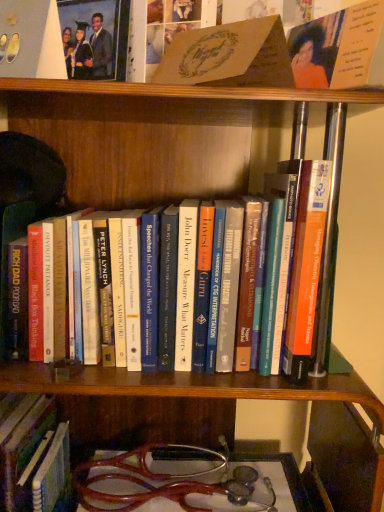
Measure the distance between matte brown card at upper center, which ranks as the second book in top-to-bottom order, and camera.

matte brown card at upper center, which ranks as the second book in top-to-bottom order, is 18.46 inches away from camera.

You are a GUI agent. You are given a task and a screenshot of the screen. Output one action in this format:
    pyautogui.click(x=<x>, y=<y>)
    Task: Click on the hardcover book at center, which appears as the 2th book when ordered from the bottom
    
    Given the screenshot: What is the action you would take?
    pyautogui.click(x=282, y=270)

The image size is (384, 512). What do you see at coordinates (88, 50) in the screenshot? I see `matte black graduation gown at upper left` at bounding box center [88, 50].

What are the coordinates of `matte brown card at upper center, which ranks as the second book in top-to-bottom order` in the screenshot? It's located at (229, 56).

From the image's perspective, is hardcover book at center, which is the 4th book from top to bottom, located above matte black graduation gown at upper left?

Incorrect, from the image's perspective, hardcover book at center, which is the 4th book from top to bottom, is lower than matte black graduation gown at upper left.

Measure the distance from hardcover book at center, which is the 4th book from top to bottom, to matte black graduation gown at upper left.

hardcover book at center, which is the 4th book from top to bottom, is 22.82 inches away from matte black graduation gown at upper left.

Where is `couple in front of the hardcover book at center, which is the 4th book from top to bottom`? The image size is (384, 512). couple in front of the hardcover book at center, which is the 4th book from top to bottom is located at coordinates (88, 50).

Considering the sizes of objects orange matte card at upper right, the 4th book ordered from the bottom, and hardcover book at center, placed as the 3th book when sorted from top to bottom, in the image provided, who is shorter, orange matte card at upper right, the 4th book ordered from the bottom, or hardcover book at center, placed as the 3th book when sorted from top to bottom,?

orange matte card at upper right, the 4th book ordered from the bottom, is shorter.

Is orange matte card at upper right, acting as the first book starting from the top, closer to the viewer compared to hardcover book at center, placed as the 3th book when sorted from top to bottom?

Yes, orange matte card at upper right, acting as the first book starting from the top, is closer to the viewer.

From a real-world perspective, is orange matte card at upper right, acting as the first book starting from the top, physically located above or below hardcover book at center, placed as the 3th book when sorted from top to bottom?

In terms of real-world spatial position, orange matte card at upper right, acting as the first book starting from the top, is above hardcover book at center, placed as the 3th book when sorted from top to bottom.

Based on their sizes in the image, would you say orange matte card at upper right, the 4th book ordered from the bottom, is bigger or smaller than hardcover book at center, which appears as the 2th book when ordered from the bottom?

Considering their sizes, orange matte card at upper right, the 4th book ordered from the bottom, takes up less space than hardcover book at center, which appears as the 2th book when ordered from the bottom.

From their relative heights in the image, would you say matte black graduation gown at upper left is taller or shorter than matte brown card at upper center, which ranks as the second book in top-to-bottom order?

Clearly, matte black graduation gown at upper left is taller compared to matte brown card at upper center, which ranks as the second book in top-to-bottom order.

Based on the photo, who is bigger, matte black graduation gown at upper left or matte brown card at upper center, which ranks as the second book in top-to-bottom order?

matte brown card at upper center, which ranks as the second book in top-to-bottom order.

From the picture: Would you say matte black graduation gown at upper left is to the left or to the right of matte brown card at upper center, the 3th book from the bottom, in the picture?

From the image, it's evident that matte black graduation gown at upper left is to the left of matte brown card at upper center, the 3th book from the bottom.

Would you say matte black graduation gown at upper left contains hardcover book at center, placed as the 3th book when sorted from top to bottom?

No, hardcover book at center, placed as the 3th book when sorted from top to bottom, is located outside of matte black graduation gown at upper left.

Which of these two, matte black graduation gown at upper left or hardcover book at center, which appears as the 2th book when ordered from the bottom, stands shorter?

With less height is matte black graduation gown at upper left.

Is matte black graduation gown at upper left oriented towards hardcover book at center, which appears as the 2th book when ordered from the bottom?

No, matte black graduation gown at upper left is not facing towards hardcover book at center, which appears as the 2th book when ordered from the bottom.

The image size is (384, 512). In order to click on couple above the hardcover book at center, which appears as the 2th book when ordered from the bottom (from the image's perspective) in this screenshot , I will do `click(88, 50)`.

Which is closer to the camera, (142, 263) or (50, 467)?

Point (142, 263) is closer to the camera than point (50, 467).

Which object is wider, hardcover book at center, which appears as the 2th book when ordered from the bottom, or hardcover book at center, which is the 4th book from top to bottom?

With larger width is hardcover book at center, which is the 4th book from top to bottom.

From their relative heights in the image, would you say hardcover book at center, which appears as the 2th book when ordered from the bottom, is taller or shorter than hardcover book at center, which is the 1th book from bottom to top?

Considering their sizes, hardcover book at center, which appears as the 2th book when ordered from the bottom, has less height than hardcover book at center, which is the 1th book from bottom to top.

Considering the relative sizes of hardcover book at center, placed as the 3th book when sorted from top to bottom, and hardcover book at center, which is the 1th book from bottom to top, in the image provided, is hardcover book at center, placed as the 3th book when sorted from top to bottom, smaller than hardcover book at center, which is the 1th book from bottom to top,?

Actually, hardcover book at center, placed as the 3th book when sorted from top to bottom, might be larger than hardcover book at center, which is the 1th book from bottom to top.

From a real-world perspective, between matte brown card at upper center, the 3th book from the bottom, and hardcover book at center, which is the 4th book from top to bottom, who is vertically higher?

matte brown card at upper center, the 3th book from the bottom, is physically above.

Which is in front, matte brown card at upper center, which ranks as the second book in top-to-bottom order, or hardcover book at center, which is the 1th book from bottom to top?

matte brown card at upper center, which ranks as the second book in top-to-bottom order.

Would you say matte brown card at upper center, the 3th book from the bottom, is to the left or to the right of hardcover book at center, which is the 4th book from top to bottom, in the picture?

matte brown card at upper center, the 3th book from the bottom, is to the right of hardcover book at center, which is the 4th book from top to bottom.

Starting from the hardcover book at center, which is the 1th book from bottom to top, which book is the 3rd one in front? Please provide its 2D coordinates.

[(229, 56)]

Is orange matte card at upper right, the 4th book ordered from the bottom, bigger than hardcover book at center, which is the 4th book from top to bottom?

No, orange matte card at upper right, the 4th book ordered from the bottom, is not bigger than hardcover book at center, which is the 4th book from top to bottom.

Can you confirm if orange matte card at upper right, acting as the first book starting from the top, is taller than hardcover book at center, which is the 1th book from bottom to top?

No.

Is orange matte card at upper right, the 4th book ordered from the bottom, facing away from hardcover book at center, which is the 1th book from bottom to top?

That's not correct — orange matte card at upper right, the 4th book ordered from the bottom, is not looking away from hardcover book at center, which is the 1th book from bottom to top.

Looking at this image, would you consider orange matte card at upper right, acting as the first book starting from the top, to be distant from hardcover book at center, which is the 4th book from top to bottom?

Actually, orange matte card at upper right, acting as the first book starting from the top, and hardcover book at center, which is the 4th book from top to bottom, are a little close together.

This screenshot has height=512, width=384. In order to click on couple above the hardcover book at center, which is the 1th book from bottom to top (from a real-world perspective) in this screenshot , I will do `click(88, 50)`.

Find the location of `the 2nd book above when counting from the hardcover book at center, placed as the 3th book when sorted from top to bottom (from the image's perspective)`. the 2nd book above when counting from the hardcover book at center, placed as the 3th book when sorted from top to bottom (from the image's perspective) is located at coordinates (340, 49).

Based on their spatial positions, is hardcover book at center, which is the 4th book from top to bottom, or matte brown card at upper center, which ranks as the second book in top-to-bottom order, further from hardcover book at center, placed as the 3th book when sorted from top to bottom?

hardcover book at center, which is the 4th book from top to bottom, lies further to hardcover book at center, placed as the 3th book when sorted from top to bottom, than the other object.

Looking at this image, estimate the real-world distances between objects in this image. Which object is further from orange matte card at upper right, the 4th book ordered from the bottom, matte black graduation gown at upper left or hardcover book at center, which is the 4th book from top to bottom?

The object further to orange matte card at upper right, the 4th book ordered from the bottom, is hardcover book at center, which is the 4th book from top to bottom.

From the image, which object appears to be nearer to matte black graduation gown at upper left, matte brown card at upper center, the 3th book from the bottom, or hardcover book at center, which appears as the 2th book when ordered from the bottom?

Among the two, matte brown card at upper center, the 3th book from the bottom, is located nearer to matte black graduation gown at upper left.

Considering their positions, is hardcover book at center, placed as the 3th book when sorted from top to bottom, positioned closer to matte black graduation gown at upper left than orange matte card at upper right, acting as the first book starting from the top?

orange matte card at upper right, acting as the first book starting from the top, is positioned closer to the anchor matte black graduation gown at upper left.

Which object lies nearer to the anchor point orange matte card at upper right, acting as the first book starting from the top, matte brown card at upper center, which ranks as the second book in top-to-bottom order, or matte black graduation gown at upper left?

Among the two, matte brown card at upper center, which ranks as the second book in top-to-bottom order, is located nearer to orange matte card at upper right, acting as the first book starting from the top.

When comparing their distances from orange matte card at upper right, the 4th book ordered from the bottom, does hardcover book at center, placed as the 3th book when sorted from top to bottom, or matte brown card at upper center, which ranks as the second book in top-to-bottom order, seem further?

hardcover book at center, placed as the 3th book when sorted from top to bottom.

Based on their spatial positions, is hardcover book at center, which is the 4th book from top to bottom, or matte brown card at upper center, which ranks as the second book in top-to-bottom order, closer to matte black graduation gown at upper left?

matte brown card at upper center, which ranks as the second book in top-to-bottom order, is closer to matte black graduation gown at upper left.

From the image, which object appears to be farther from hardcover book at center, which is the 4th book from top to bottom, matte brown card at upper center, which ranks as the second book in top-to-bottom order, or hardcover book at center, which appears as the 2th book when ordered from the bottom?

matte brown card at upper center, which ranks as the second book in top-to-bottom order, is further to hardcover book at center, which is the 4th book from top to bottom.

The image size is (384, 512). What are the coordinates of `book between orange matte card at upper right, acting as the first book starting from the top, and hardcover book at center, placed as the 3th book when sorted from top to bottom, in the vertical direction` in the screenshot? It's located at [x=229, y=56].

What are the coordinates of `book between matte brown card at upper center, the 3th book from the bottom, and hardcover book at center, which is the 4th book from top to bottom, in the vertical direction` in the screenshot? It's located at (282, 270).